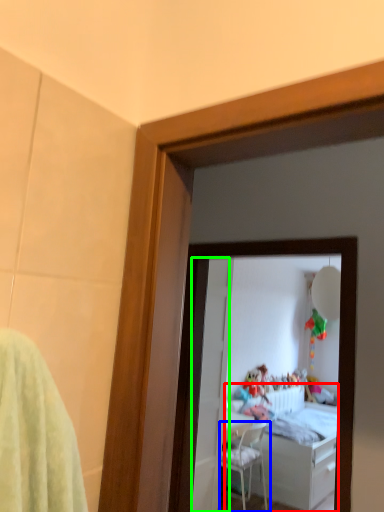
Question: Based on their relative distances, which object is farther from bed (highlighted by a red box)? Choose from chair (highlighted by a blue box) and door (highlighted by a green box).

Choices:
 (A) chair
 (B) door

Answer: (B)